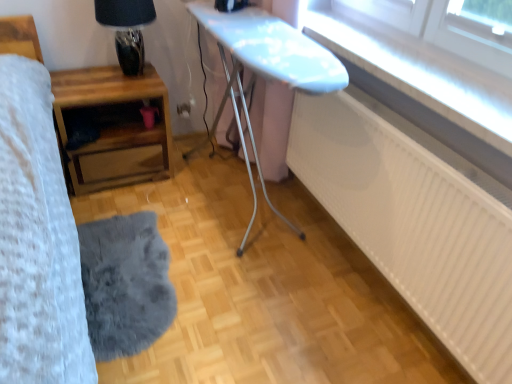
You are a GUI agent. You are given a task and a screenshot of the screen. Output one action in this format:
    pyautogui.click(x=<x>, y=<y>)
    Task: Click on the vacant space in front of wooden nightstand at left, which ranks as the second table in right-to-left order
    This screenshot has height=384, width=512.
    Given the screenshot: What is the action you would take?
    pyautogui.click(x=120, y=215)